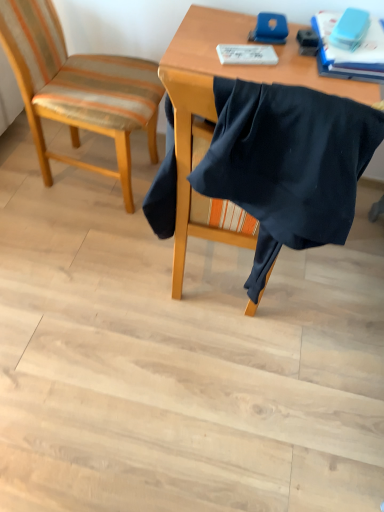
Question: Considering the relative sizes of blue matte book at upper right and black fabric at center, the first chair in the right-to-left sequence, in the image provided, is blue matte book at upper right bigger than black fabric at center, the first chair in the right-to-left sequence,?

Choices:
 (A) no
 (B) yes

Answer: (A)

Question: Does blue matte book at upper right appear on the right side of black fabric at center, acting as the 2th chair starting from the left?

Choices:
 (A) no
 (B) yes

Answer: (B)

Question: Considering the relative sizes of blue matte book at upper right and black fabric at center, acting as the 2th chair starting from the left, in the image provided, is blue matte book at upper right taller than black fabric at center, acting as the 2th chair starting from the left,?

Choices:
 (A) no
 (B) yes

Answer: (A)

Question: Does blue matte book at upper right come behind black fabric at center, acting as the 2th chair starting from the left?

Choices:
 (A) yes
 (B) no

Answer: (A)

Question: From a real-world perspective, is blue matte book at upper right under black fabric at center, acting as the 2th chair starting from the left?

Choices:
 (A) yes
 (B) no

Answer: (B)

Question: Based on their sizes in the image, would you say black fabric at center, acting as the 2th chair starting from the left, is bigger or smaller than blue matte book at upper right?

Choices:
 (A) small
 (B) big

Answer: (B)

Question: From the image's perspective, relative to blue matte book at upper right, is black fabric at center, acting as the 2th chair starting from the left, above or below?

Choices:
 (A) below
 (B) above

Answer: (A)

Question: From their relative heights in the image, would you say black fabric at center, acting as the 2th chair starting from the left, is taller or shorter than blue matte book at upper right?

Choices:
 (A) short
 (B) tall

Answer: (B)

Question: Does point (236, 111) appear closer or farther from the camera than point (316, 27)?

Choices:
 (A) farther
 (B) closer

Answer: (B)

Question: Considering the positions of black fabric at center, the first chair in the right-to-left sequence, and striped fabric chair at left, placed as the 2th chair when sorted from right to left, in the image, is black fabric at center, the first chair in the right-to-left sequence, taller or shorter than striped fabric chair at left, placed as the 2th chair when sorted from right to left,?

Choices:
 (A) short
 (B) tall

Answer: (A)

Question: Is black fabric at center, acting as the 2th chair starting from the left, bigger or smaller than striped fabric chair at left, marked as the first chair in a left-to-right arrangement?

Choices:
 (A) big
 (B) small

Answer: (B)

Question: Relative to striped fabric chair at left, placed as the 2th chair when sorted from right to left, is black fabric at center, acting as the 2th chair starting from the left, in front or behind?

Choices:
 (A) behind
 (B) front

Answer: (B)

Question: Which is correct: black fabric at center, acting as the 2th chair starting from the left, is inside striped fabric chair at left, marked as the first chair in a left-to-right arrangement, or outside of it?

Choices:
 (A) outside
 (B) inside

Answer: (A)

Question: From a real-world perspective, is striped fabric chair at left, placed as the 2th chair when sorted from right to left, above or below blue matte book at upper right?

Choices:
 (A) above
 (B) below

Answer: (B)

Question: Is striped fabric chair at left, placed as the 2th chair when sorted from right to left, spatially inside blue matte book at upper right, or outside of it?

Choices:
 (A) inside
 (B) outside

Answer: (B)